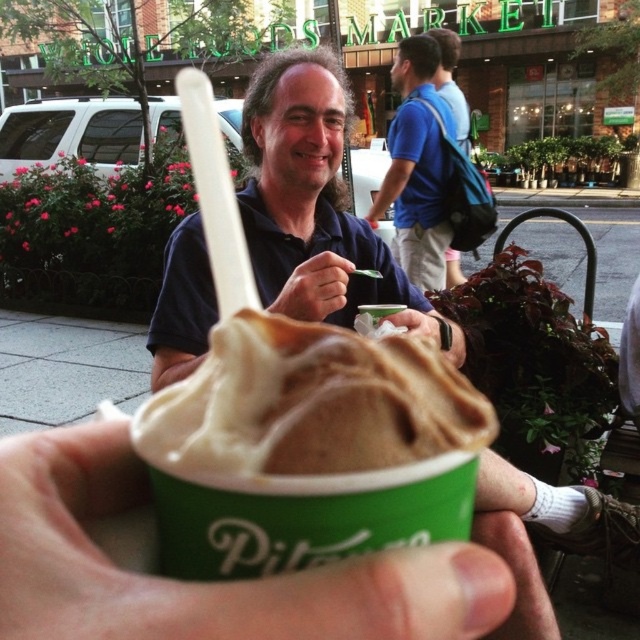
In the scene shown: You are standing in front of the Whole Foods Market and see two points in the scene. The first point is at coordinates point (429, 97) and the second point is at point (300, 266). Which point is closer to you?

Point (429, 97) is closer to you because it is further to the viewer than point (300, 266).

You are a photographer trying to capture the scene in front of the Whole Foods Market. You notice the blue cotton shirt at upper center and the matte black hand at center. Which object is located higher in the image?

The blue cotton shirt at upper center is positioned over the matte black hand at center, so it is higher in the image.